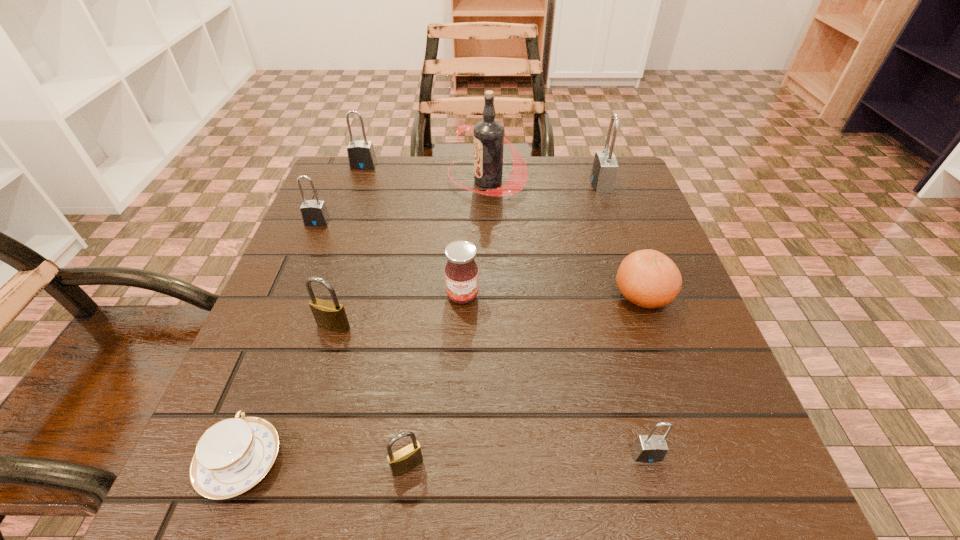
Locate an element on the screen. free space located on the side with the handle of the teacup is located at coordinates (291, 332).

At what (x,y) coordinates should I click in order to perform the action: click on free location located on the side with the handle of the teacup. Please return your answer as a coordinate pair (x, y). Looking at the image, I should click on 283,350.

Locate an element on the screen. This screenshot has height=540, width=960. vacant space situated 0.260m on the side with the handle of the teacup is located at coordinates (305, 294).

At what (x,y) coordinates should I click in order to perform the action: click on root beer at the far edge. Please return your answer as a coordinate pair (x, y). Looking at the image, I should click on (488, 134).

You are a GUI agent. You are given a task and a screenshot of the screen. Output one action in this format:
    pyautogui.click(x=<x>, y=<y>)
    Task: Click on the teacup that is at the near edge
    This screenshot has width=960, height=540.
    Given the screenshot: What is the action you would take?
    pyautogui.click(x=233, y=455)

At what (x,y) coordinates should I click in order to perform the action: click on teacup that is at the left edge. Please return your answer as a coordinate pair (x, y). The width and height of the screenshot is (960, 540). Looking at the image, I should click on (233, 455).

Identify the location of clementine present at the right edge. (648, 278).

This screenshot has height=540, width=960. I want to click on object present at the far left corner, so click(361, 155).

The image size is (960, 540). I want to click on object present at the near left corner, so click(233, 455).

Find the location of a particular element. The width and height of the screenshot is (960, 540). object that is at the far right corner is located at coordinates (604, 170).